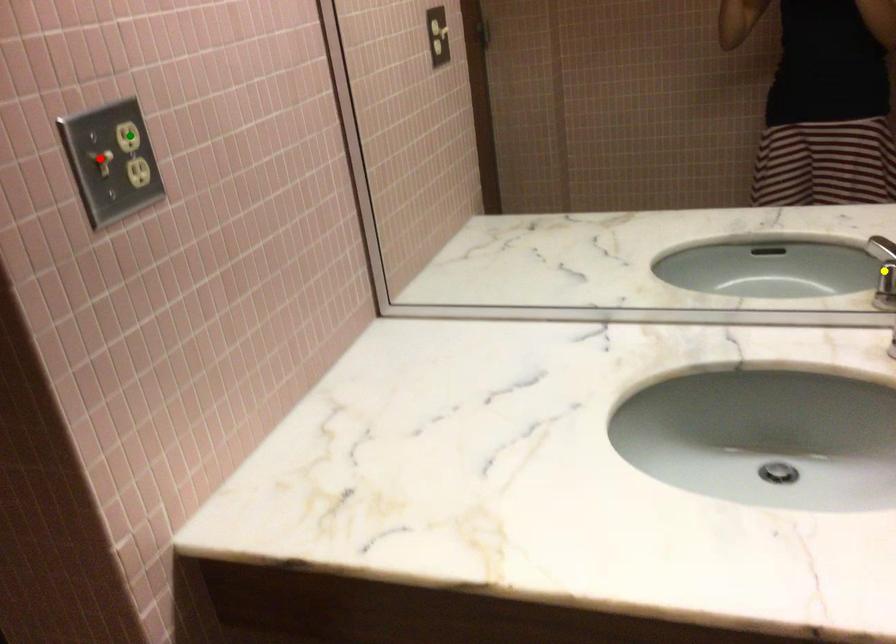
Order these from nearest to farthest:
1. green point
2. yellow point
3. red point

1. yellow point
2. green point
3. red point